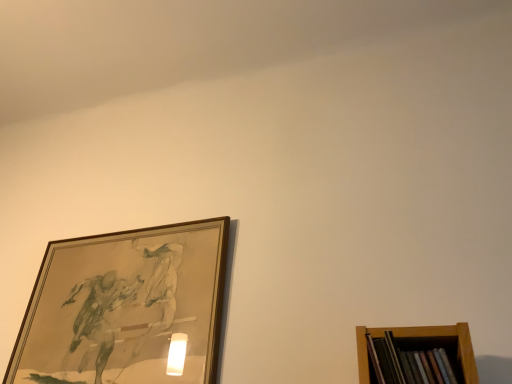
At what (x,y) coordinates should I click in order to perform the action: click on wooden picture frame at upper left. Please return your answer as a coordinate pair (x, y). Image resolution: width=512 pixels, height=384 pixels. Looking at the image, I should click on (126, 308).

Measure the distance between point (76, 267) and camera.

The distance of point (76, 267) from camera is 4.73 feet.

Describe the element at coordinates (126, 308) in the screenshot. This screenshot has height=384, width=512. I see `wooden picture frame at upper left` at that location.

At what (x,y) coordinates should I click in order to perform the action: click on wooden picture frame at upper left. Please return your answer as a coordinate pair (x, y). Looking at the image, I should click on (126, 308).